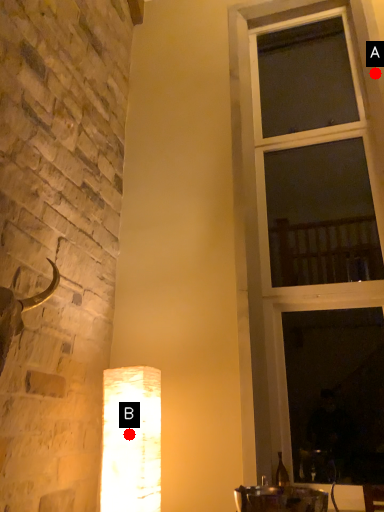
Question: Two points are circled on the image, labeled by A and B beside each circle. Which of the following is the farthest from the observer?

Choices:
 (A) A is further
 (B) B is further

Answer: (A)